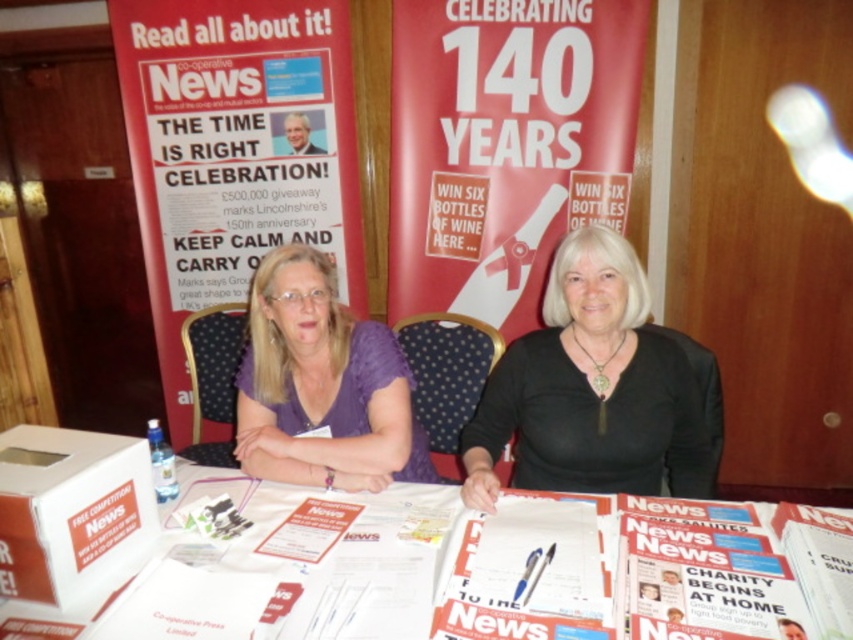
Question: Among these objects, which one is farthest from the camera?

Choices:
 (A) red matte poster at center
 (B) red cardboard poster at upper left

Answer: (B)

Question: Which point appears farthest from the camera in this image?

Choices:
 (A) (96, 608)
 (B) (247, 17)
 (C) (579, 275)

Answer: (B)

Question: Does white paper at center appear on the right side of white glossy magazine at center?

Choices:
 (A) no
 (B) yes

Answer: (A)

Question: Can you confirm if matte purple blouse at center is positioned above white glossy magazine at center?

Choices:
 (A) yes
 (B) no

Answer: (A)

Question: Is white glossy magazine at center below white glossy paper at center?

Choices:
 (A) yes
 (B) no

Answer: (B)

Question: Which object appears closest to the camera in this image?

Choices:
 (A) black matte shirt at center
 (B) white glossy magazine at center

Answer: (B)